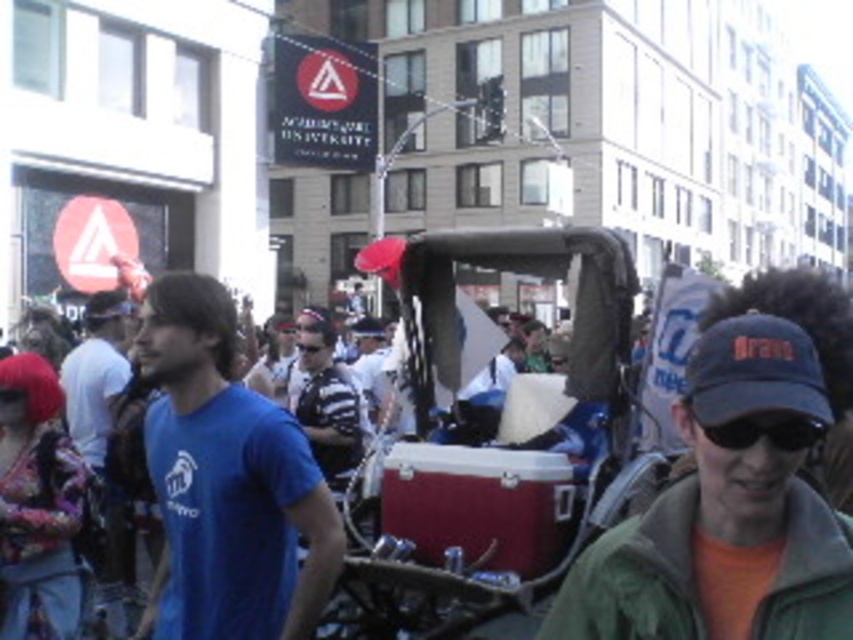
Can you confirm if green fuzzy jacket at lower right is positioned to the left of matte black goggles at lower left?

No, green fuzzy jacket at lower right is not to the left of matte black goggles at lower left.

Who is more distant from viewer, (773, 600) or (16, 403)?

Point (16, 403)

Find the location of `green fuzzy jacket at lower right`. green fuzzy jacket at lower right is located at coordinates (635, 577).

Can you confirm if green fuzzy jacket at lower right is taller than striped shirt at center?

No.

The height and width of the screenshot is (640, 853). What do you see at coordinates (635, 577) in the screenshot? I see `green fuzzy jacket at lower right` at bounding box center [635, 577].

You are a GUI agent. You are given a task and a screenshot of the screen. Output one action in this format:
    pyautogui.click(x=<x>, y=<y>)
    Task: Click on the green fuzzy jacket at lower right
    
    Given the screenshot: What is the action you would take?
    pyautogui.click(x=635, y=577)

Between blue fabric baseball cap at lower right and black matte goggles at center, which one appears on the left side from the viewer's perspective?

Positioned to the left is black matte goggles at center.

How far apart are blue fabric baseball cap at lower right and black matte goggles at center?

blue fabric baseball cap at lower right and black matte goggles at center are 16.01 meters apart from each other.

This screenshot has width=853, height=640. I want to click on blue fabric baseball cap at lower right, so click(753, 371).